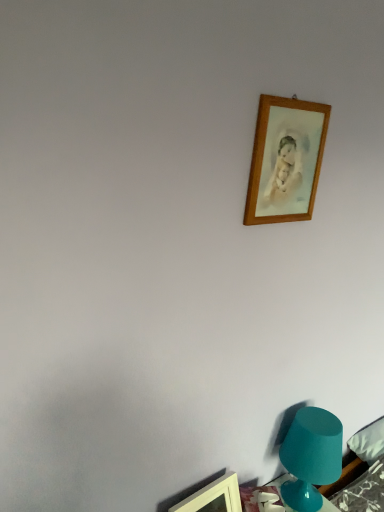
Question: Can you confirm if wooden picture frame at upper right, acting as the first picture frame starting from the top, is bigger than wooden picture frame at upper right, placed as the 1th picture frame when sorted from left to right?

Choices:
 (A) yes
 (B) no

Answer: (B)

Question: Does wooden picture frame at upper right, acting as the first picture frame starting from the top, have a lesser height compared to wooden picture frame at upper right, placed as the 1th picture frame when sorted from left to right?

Choices:
 (A) no
 (B) yes

Answer: (A)

Question: Would you say wooden picture frame at upper right, positioned as the 2th picture frame in right-to-left order, is part of wooden picture frame at upper right, acting as the first picture frame starting from the top,'s contents?

Choices:
 (A) yes
 (B) no

Answer: (B)

Question: Is wooden picture frame at upper right, which is counted as the second picture frame, starting from the bottom, aimed at wooden picture frame at upper right, which ranks as the 1th picture frame in bottom-to-top order?

Choices:
 (A) yes
 (B) no

Answer: (B)

Question: Can you see wooden picture frame at upper right, which ranks as the second picture frame in left-to-right order, touching wooden picture frame at upper right, which ranks as the 1th picture frame in bottom-to-top order?

Choices:
 (A) yes
 (B) no

Answer: (B)

Question: Looking at the image, does wooden picture frame at upper right, which ranks as the second picture frame in left-to-right order, seem bigger or smaller compared to teal glass lamp at lower right?

Choices:
 (A) small
 (B) big

Answer: (A)

Question: Relative to teal glass lamp at lower right, is wooden picture frame at upper right, acting as the first picture frame starting from the top, in front or behind?

Choices:
 (A) behind
 (B) front

Answer: (B)

Question: From the image's perspective, is wooden picture frame at upper right, which is counted as the second picture frame, starting from the bottom, positioned above or below teal glass lamp at lower right?

Choices:
 (A) above
 (B) below

Answer: (A)

Question: Considering the positions of wooden picture frame at upper right, which ranks as the second picture frame in left-to-right order, and teal glass lamp at lower right in the image, is wooden picture frame at upper right, which ranks as the second picture frame in left-to-right order, taller or shorter than teal glass lamp at lower right?

Choices:
 (A) short
 (B) tall

Answer: (A)

Question: Considering the positions of wooden picture frame at upper right, positioned as the 2th picture frame in right-to-left order, and wooden picture frame at upper right, which is counted as the second picture frame, starting from the bottom, in the image, is wooden picture frame at upper right, positioned as the 2th picture frame in right-to-left order, taller or shorter than wooden picture frame at upper right, which is counted as the second picture frame, starting from the bottom,?

Choices:
 (A) short
 (B) tall

Answer: (A)

Question: Does point (231, 493) appear closer or farther from the camera than point (324, 114)?

Choices:
 (A) farther
 (B) closer

Answer: (A)

Question: In the image, is wooden picture frame at upper right, which is the 2th picture frame from top to bottom, positioned in front of or behind wooden picture frame at upper right, which is counted as the second picture frame, starting from the bottom?

Choices:
 (A) behind
 (B) front

Answer: (A)

Question: Choose the correct answer: Is wooden picture frame at upper right, positioned as the 2th picture frame in right-to-left order, inside wooden picture frame at upper right, which ranks as the 1th picture frame in right-to-left order, or outside it?

Choices:
 (A) inside
 (B) outside

Answer: (B)

Question: Considering the relative positions of wooden picture frame at upper right, which ranks as the 1th picture frame in right-to-left order, and wooden picture frame at upper right, positioned as the 2th picture frame in right-to-left order, in the image provided, is wooden picture frame at upper right, which ranks as the 1th picture frame in right-to-left order, to the left or to the right of wooden picture frame at upper right, positioned as the 2th picture frame in right-to-left order,?

Choices:
 (A) left
 (B) right

Answer: (B)

Question: Considering the positions of wooden picture frame at upper right, which ranks as the 1th picture frame in right-to-left order, and wooden picture frame at upper right, placed as the 1th picture frame when sorted from left to right, in the image, is wooden picture frame at upper right, which ranks as the 1th picture frame in right-to-left order, bigger or smaller than wooden picture frame at upper right, placed as the 1th picture frame when sorted from left to right,?

Choices:
 (A) small
 (B) big

Answer: (A)